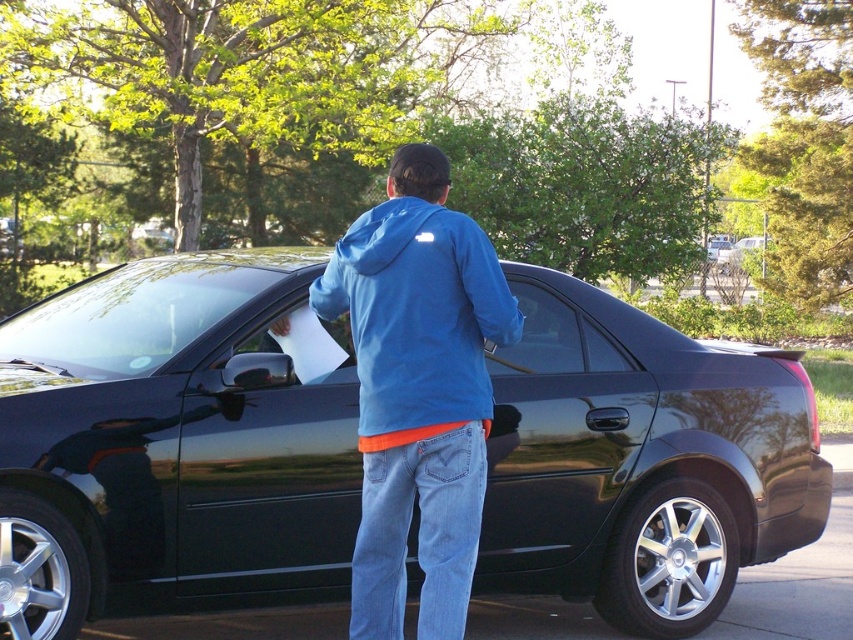
Consider the image. Does blue cotton hoodie at center have a lesser height compared to blue fleece sweatshirt at center?

Incorrect, blue cotton hoodie at center's height does not fall short of blue fleece sweatshirt at center's.

Image resolution: width=853 pixels, height=640 pixels. In order to click on blue cotton hoodie at center in this screenshot , I will do (x=418, y=390).

Measure the distance between point (393,550) and camera.

Point (393,550) is 4.31 meters from camera.

What are the coordinates of `blue cotton hoodie at center` in the screenshot? It's located at (x=418, y=390).

Is glossy black car at center taller than blue fleece sweatshirt at center?

Yes, glossy black car at center is taller than blue fleece sweatshirt at center.

Is point (624, 307) behind point (459, 324)?

Yes, it is.

Between point (599, 376) and point (473, 312), which one is positioned in front?

Point (473, 312) is more forward.

At what (x,y) coordinates should I click in order to perform the action: click on glossy black car at center. Please return your answer as a coordinate pair (x, y). The width and height of the screenshot is (853, 640). Looking at the image, I should click on (175, 444).

Between glossy black car at center and blue cotton hoodie at center, which one appears on the left side from the viewer's perspective?

glossy black car at center is more to the left.

Is glossy black car at center shorter than blue cotton hoodie at center?

Indeed, glossy black car at center has a lesser height compared to blue cotton hoodie at center.

Who is more forward, (202, 394) or (376, 428)?

Positioned in front is point (376, 428).

The width and height of the screenshot is (853, 640). What are the coordinates of `glossy black car at center` in the screenshot? It's located at (175, 444).